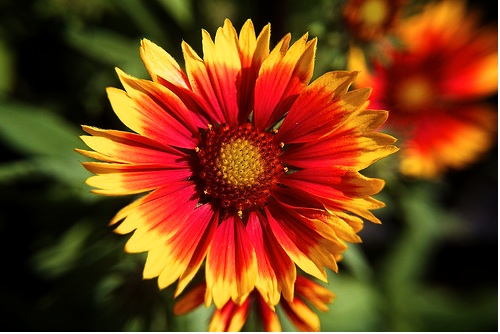
I want to click on plant, so click(213, 166), click(449, 87), click(59, 159), click(109, 47), click(307, 24), click(405, 267), click(349, 289), click(253, 323).